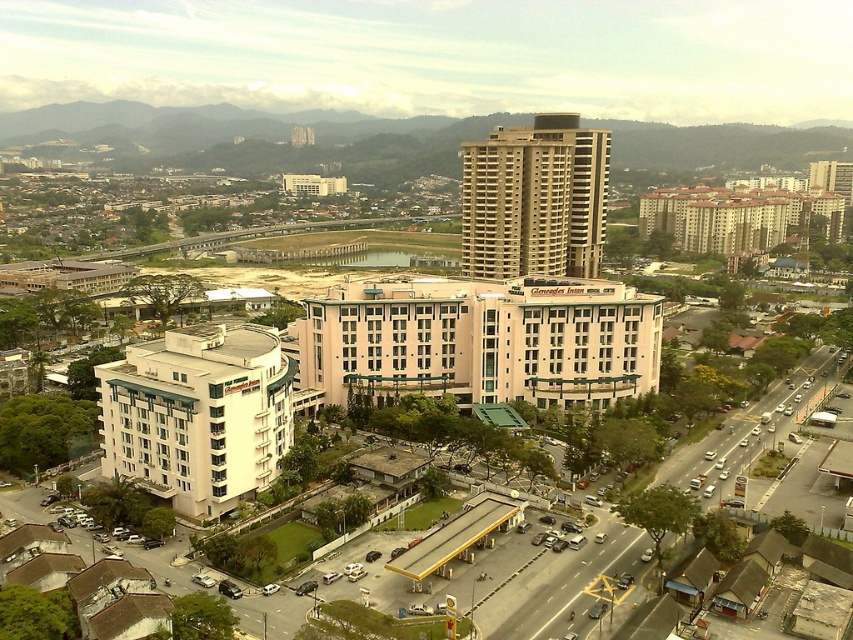
You are a city planner analyzing the urban layout. You need to determine if the pink concrete building at center can accommodate a new wing addition that requires the same width as the beige concrete building at center. Based on the spatial relationship between them, is this feasible?

The pink concrete building at center might be wider than beige concrete building at center, so it is possible that the pink concrete building at center can accommodate the new wing addition since its width could be sufficient.

You are navigating an aerial map of an urban area and need to locate the white glossy building at lower left. According to the map, what are the coordinates of this building?

The white glossy building at lower left is located at point (198, 413).